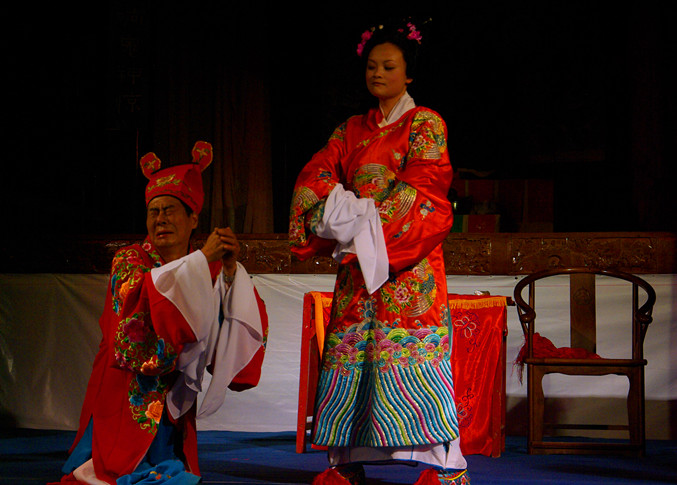
Find the location of `wood chair`. wood chair is located at coordinates (596, 364).